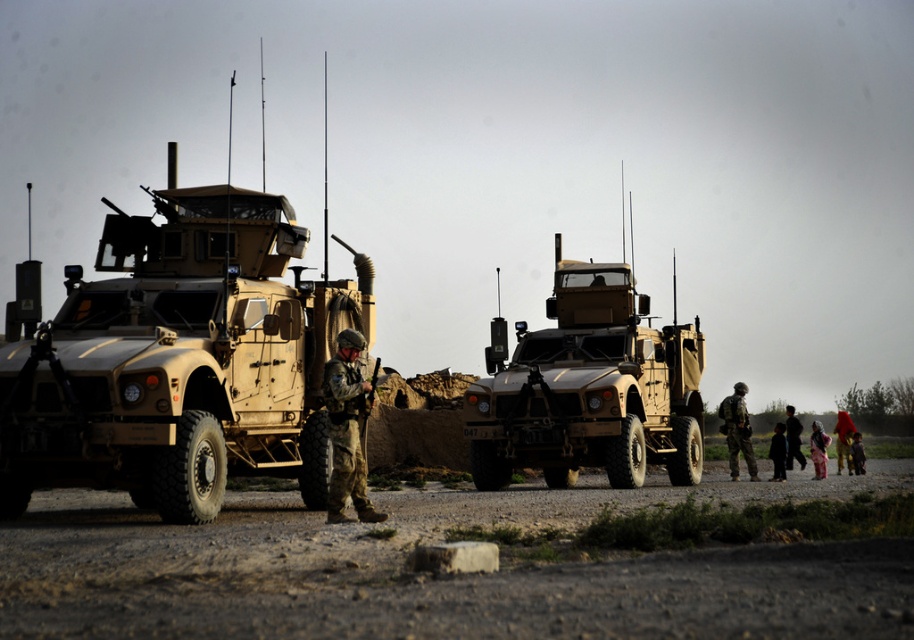
Question: Which point is closer to the camera?

Choices:
 (A) camouflage uniform at right
 (B) matte tan military vehicle at center

Answer: (B)

Question: Which point is farther to the camera?

Choices:
 (A) matte tan military vehicle at left
 (B) dark clothing at right
 (C) camouflage fabric uniform at center
 (D) red fabric dress at lower right

Answer: (D)

Question: Among these points, which one is farthest from the camera?

Choices:
 (A) (535, 388)
 (B) (788, 454)
 (C) (772, 458)
 (D) (853, 438)

Answer: (D)

Question: Can you confirm if orange fabric headscarf at lower right is positioned above pink fabric dress at lower right?

Choices:
 (A) no
 (B) yes

Answer: (B)

Question: Is pink fabric dress at lower right further to camera compared to red fabric dress at lower right?

Choices:
 (A) yes
 (B) no

Answer: (B)

Question: Can you confirm if camouflage uniform at right is positioned below red fabric dress at lower right?

Choices:
 (A) no
 (B) yes

Answer: (A)